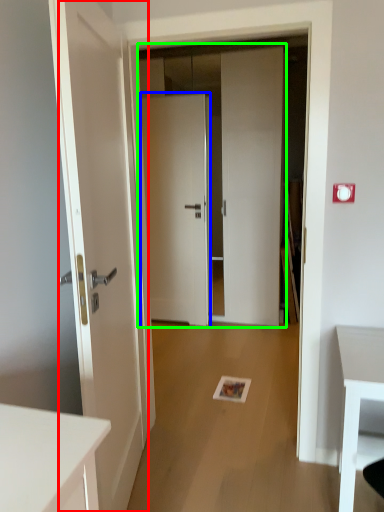
Question: Based on their relative distances, which object is nearer to door (highlighted by a red box)? Choose from door (highlighted by a blue box) and door (highlighted by a green box).

Choices:
 (A) door
 (B) door

Answer: (B)